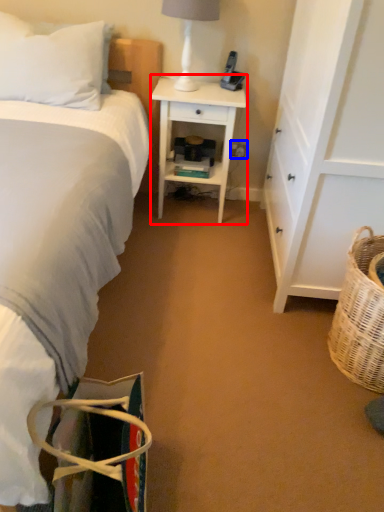
Question: Which point is further to the camera, desk (highlighted by a red box) or electric outlet (highlighted by a blue box)?

Choices:
 (A) desk
 (B) electric outlet

Answer: (B)